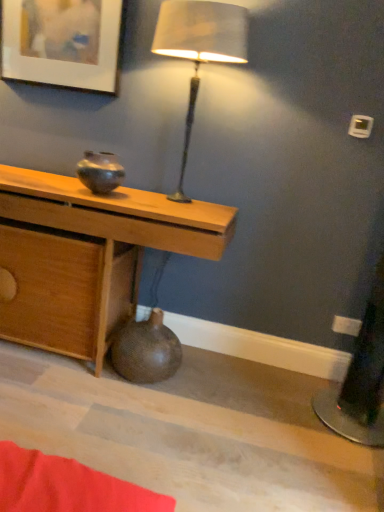
Question: Is brown textured vase at lower center, which is counted as the second vase, starting from the top, positioned beyond the bounds of wooden desk at center?

Choices:
 (A) yes
 (B) no

Answer: (B)

Question: Does brown textured vase at lower center, which is counted as the second vase, starting from the top, come behind wooden desk at center?

Choices:
 (A) no
 (B) yes

Answer: (B)

Question: From the image's perspective, is brown textured vase at lower center, which is counted as the second vase, starting from the top, below wooden desk at center?

Choices:
 (A) no
 (B) yes

Answer: (B)

Question: Could wooden desk at center be considered to be inside brown textured vase at lower center, which is counted as the second vase, starting from the top?

Choices:
 (A) no
 (B) yes

Answer: (A)

Question: Does brown textured vase at lower center, which is counted as the second vase, starting from the top, have a smaller size compared to wooden desk at center?

Choices:
 (A) yes
 (B) no

Answer: (A)

Question: Is point (185, 195) closer or farther from the camera than point (188, 247)?

Choices:
 (A) closer
 (B) farther

Answer: (B)

Question: Considering the positions of satin beige lampshade at upper center and wooden desk at center in the image, is satin beige lampshade at upper center wider or thinner than wooden desk at center?

Choices:
 (A) thin
 (B) wide

Answer: (A)

Question: Relative to wooden desk at center, is satin beige lampshade at upper center in front or behind?

Choices:
 (A) behind
 (B) front

Answer: (B)

Question: From the image's perspective, is satin beige lampshade at upper center positioned above or below wooden desk at center?

Choices:
 (A) below
 (B) above

Answer: (B)

Question: Looking at the image, does satin beige lampshade at upper center seem bigger or smaller compared to brown textured vase at lower center, placed as the first vase when sorted from bottom to top?

Choices:
 (A) big
 (B) small

Answer: (A)

Question: Considering the relative positions of satin beige lampshade at upper center and brown textured vase at lower center, placed as the first vase when sorted from bottom to top, in the image provided, is satin beige lampshade at upper center to the left or to the right of brown textured vase at lower center, placed as the first vase when sorted from bottom to top,?

Choices:
 (A) right
 (B) left

Answer: (A)

Question: From a real-world perspective, is satin beige lampshade at upper center physically located above or below brown textured vase at lower center, which is counted as the second vase, starting from the top?

Choices:
 (A) below
 (B) above

Answer: (B)

Question: Considering their positions, is satin beige lampshade at upper center located in front of or behind brown textured vase at lower center, placed as the first vase when sorted from bottom to top?

Choices:
 (A) front
 (B) behind

Answer: (A)

Question: Looking at their shapes, would you say wooden desk at center is wider or thinner than matte white picture frame at upper left?

Choices:
 (A) thin
 (B) wide

Answer: (B)

Question: Considering the positions of wooden desk at center and matte white picture frame at upper left in the image, is wooden desk at center taller or shorter than matte white picture frame at upper left?

Choices:
 (A) tall
 (B) short

Answer: (A)